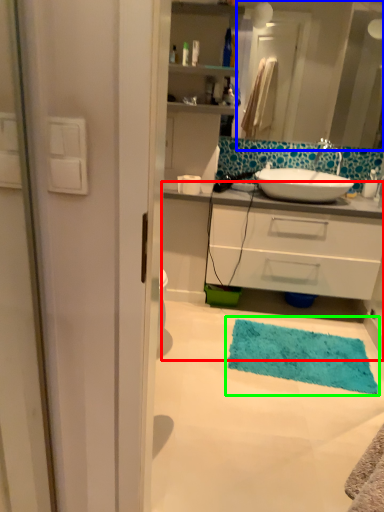
Question: Considering the real-world distances, which object is farthest from bathroom cabinet (highlighted by a red box)? mirror (highlighted by a blue box) or bath mat (highlighted by a green box)?

Choices:
 (A) mirror
 (B) bath mat

Answer: (A)